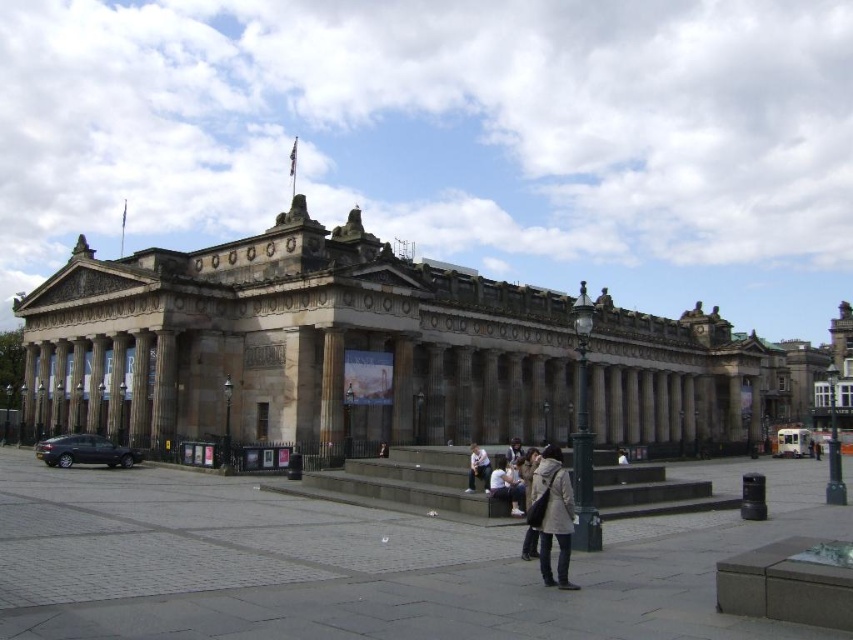
Question: Can you confirm if light brown leather jacket at lower center is positioned to the left of dark gray coat at center?

Choices:
 (A) yes
 (B) no

Answer: (B)

Question: Which of these objects is positioned farthest from the smooth stone column at center?

Choices:
 (A) light brown leather jacket at center
 (B) light brown leather jacket at lower center
 (C) light gray fabric jacket at lower center
 (D) dark gray coat at center

Answer: (C)

Question: Which object appears farthest from the camera in this image?

Choices:
 (A) light brown leather coat at lower center
 (B) smooth stone column at center
 (C) dark gray coat at center
 (D) light brown leather jacket at center

Answer: (C)

Question: Considering the real-world distances, which object is closest to the light brown leather jacket at center?

Choices:
 (A) light brown leather coat at lower center
 (B) smooth stone column at center
 (C) dark gray coat at center

Answer: (A)

Question: Does smooth stone column at center appear under dark gray coat at center?

Choices:
 (A) yes
 (B) no

Answer: (B)

Question: Where is smooth stone column at center located in relation to light gray fabric jacket at lower center in the image?

Choices:
 (A) below
 (B) above

Answer: (B)